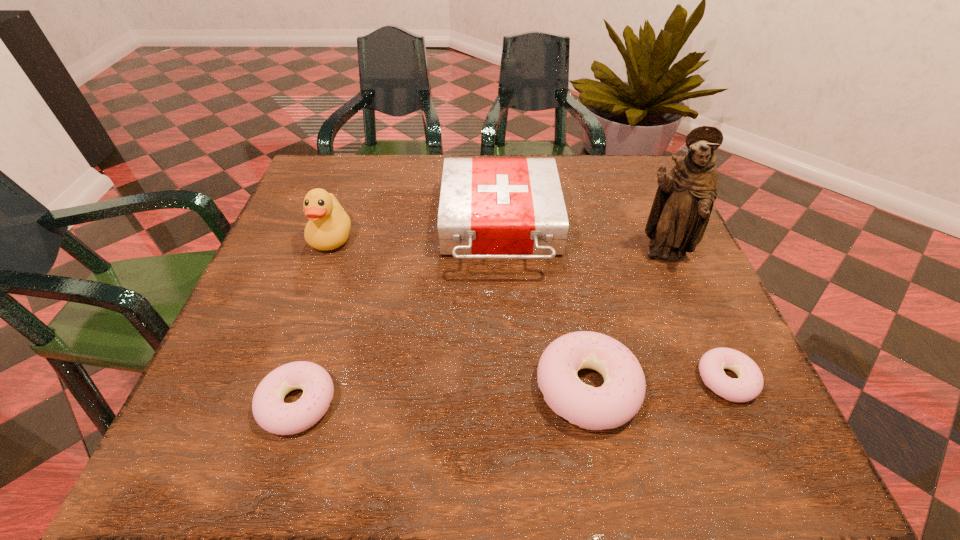
This screenshot has width=960, height=540. Identify the location of free space in the image that satisfies the following two spatial constraints: 1. on the front side of the fourth shortest object; 2. on the left side of the rightmost doughnut. (508, 379).